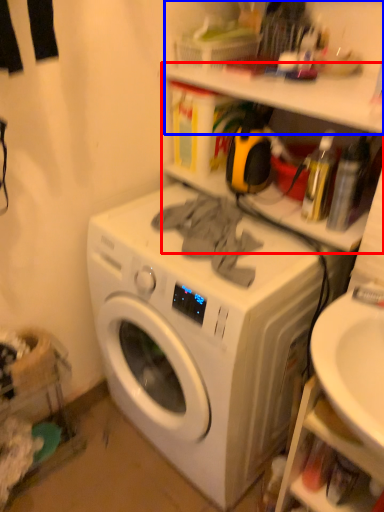
Question: Which object is further to the camera taking this photo, shelf (highlighted by a red box) or shelf (highlighted by a blue box)?

Choices:
 (A) shelf
 (B) shelf

Answer: (A)